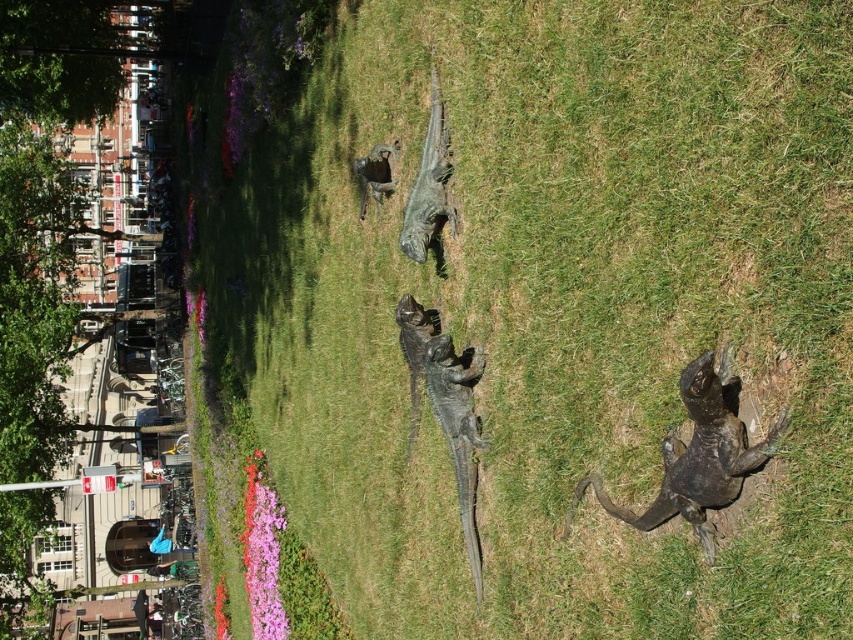
Is shiny black lizard at center above green polished stone dinosaur at center?

No, shiny black lizard at center is not above green polished stone dinosaur at center.

Locate an element on the screen. The image size is (853, 640). shiny black lizard at center is located at coordinates point(445,406).

Is point (456, 460) farther from camera compared to point (418, 180)?

No.

You are a GUI agent. You are given a task and a screenshot of the screen. Output one action in this format:
    pyautogui.click(x=<x>, y=<y>)
    Task: Click on the shiny black lizard at center
    This screenshot has height=640, width=853.
    Given the screenshot: What is the action you would take?
    pyautogui.click(x=445, y=406)

Which of these two, shiny black statue at lower right or bronze statue at center, stands shorter?

Standing shorter between the two is bronze statue at center.

Locate an element on the screen. shiny black statue at lower right is located at coordinates (697, 456).

Which is above, green polished stone dinosaur at center or bronze statue at center?

green polished stone dinosaur at center is higher up.

Between green polished stone dinosaur at center and bronze statue at center, which one has less height?

bronze statue at center is shorter.

What do you see at coordinates (428, 186) in the screenshot? I see `green polished stone dinosaur at center` at bounding box center [428, 186].

Find the location of a particular element. green polished stone dinosaur at center is located at coordinates (428, 186).